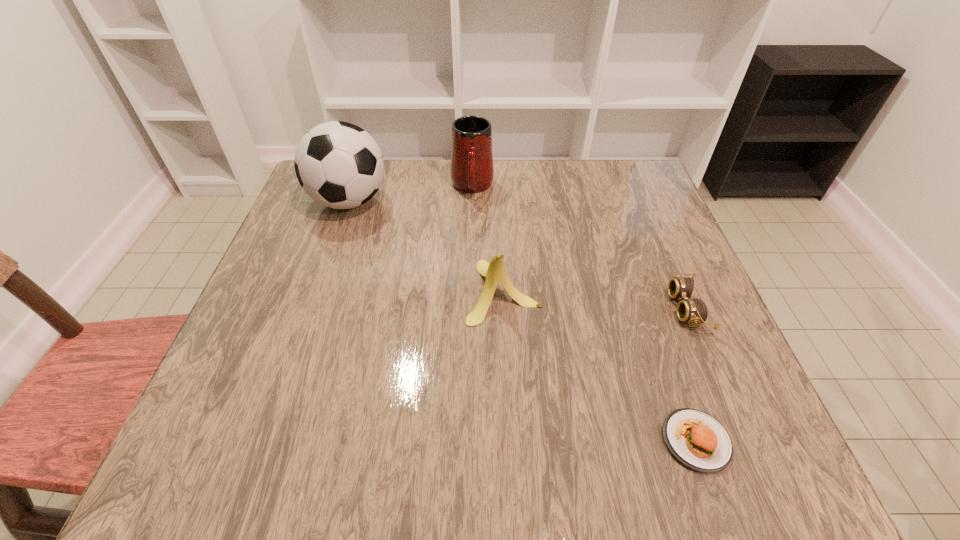
Locate an element on the screen. The image size is (960, 540). free area in between the shortest object and the soccer ball is located at coordinates pos(522,321).

This screenshot has height=540, width=960. What are the coordinates of `free area in between the nearest object and the banana` in the screenshot? It's located at (599, 366).

The height and width of the screenshot is (540, 960). Find the location of `vacant space in between the banana and the mug`. vacant space in between the banana and the mug is located at coordinates (488, 239).

The height and width of the screenshot is (540, 960). I want to click on free space between the nearest object and the fourth tallest object, so click(691, 375).

You are a GUI agent. You are given a task and a screenshot of the screen. Output one action in this format:
    pyautogui.click(x=<x>, y=<y>)
    Task: Click on the free area in between the banana and the mug
    The image size is (960, 540).
    Given the screenshot: What is the action you would take?
    pyautogui.click(x=488, y=239)

Where is `empty location between the second shortest object and the soccer ball`? The image size is (960, 540). empty location between the second shortest object and the soccer ball is located at coordinates (518, 255).

I want to click on unoccupied position between the mug and the third tallest object, so click(488, 239).

Image resolution: width=960 pixels, height=540 pixels. In order to click on vacant space in between the second shortest object and the tallest object in this screenshot , I will do `click(518, 255)`.

Locate which object is the closest to the third tallest object. Please provide its 2D coordinates. Your answer should be formatted as a tuple, i.e. [(x, y)], where the tuple contains the x and y coordinates of a point satisfying the conditions above.

[(472, 170)]

The height and width of the screenshot is (540, 960). I want to click on object that is the fourth closest to the third tallest object, so click(692, 311).